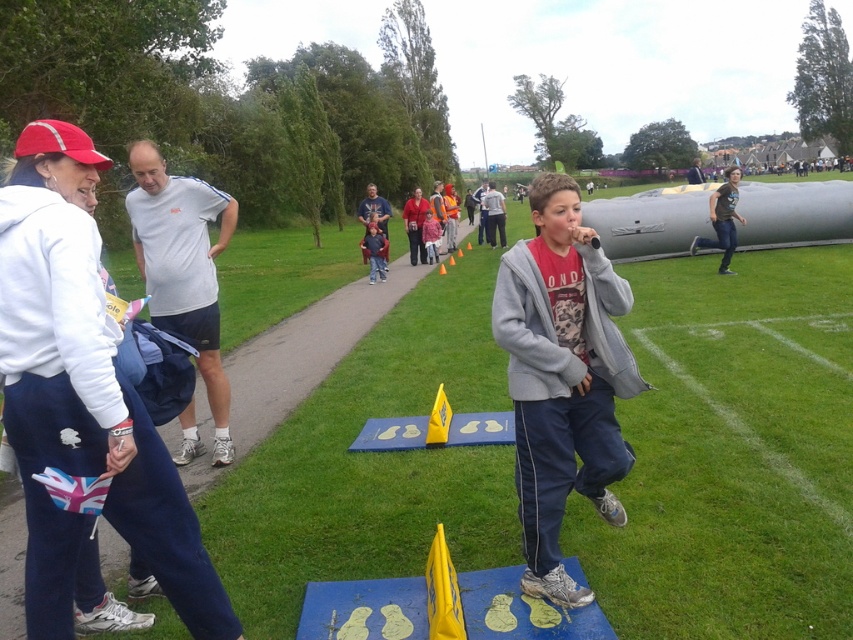
Question: Which point is farther from the camera taking this photo?

Choices:
 (A) (15, 584)
 (B) (4, 172)
 (C) (596, 289)

Answer: (A)

Question: Which of the following is the farthest from the observer?

Choices:
 (A) (602, 440)
 (B) (345, 330)

Answer: (B)

Question: Is concrete sidewalk at center bigger than white fleece jacket at upper left?

Choices:
 (A) yes
 (B) no

Answer: (A)

Question: Among these points, which one is nearest to the camera?

Choices:
 (A) (16, 564)
 (B) (570, 468)
 (C) (93, 544)

Answer: (C)

Question: Does concrete sidewalk at center come behind white fleece jacket at upper left?

Choices:
 (A) no
 (B) yes

Answer: (B)

Question: Can you confirm if red cotton hoodie at center is positioned above concrete sidewalk at center?

Choices:
 (A) yes
 (B) no

Answer: (B)